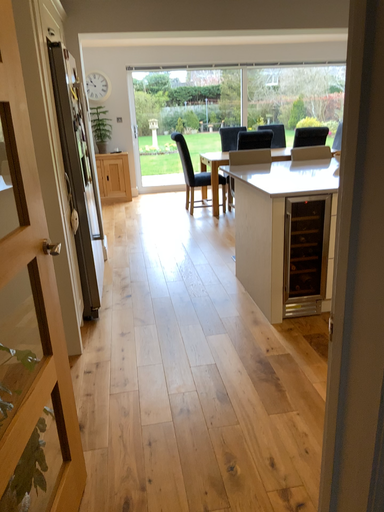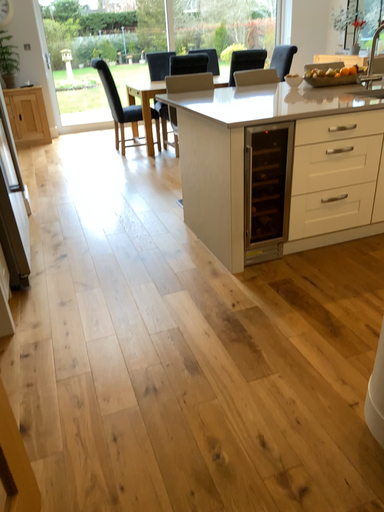
Question: Which way did the camera rotate in the video?

Choices:
 (A) rotated right
 (B) rotated left

Answer: (A)